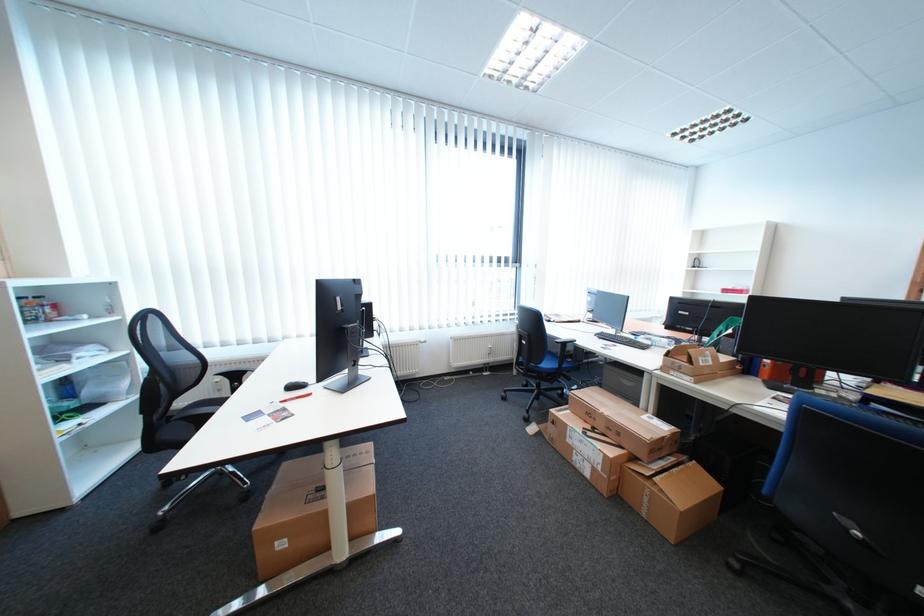
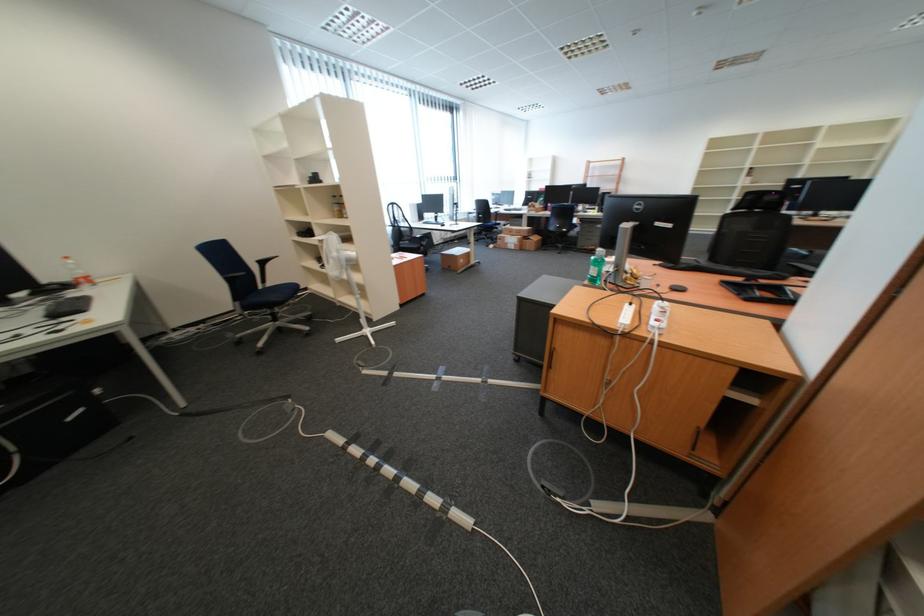
Locate, in the second image, the point that corresponds to the point at 600,476 in the first image.

(525, 249)